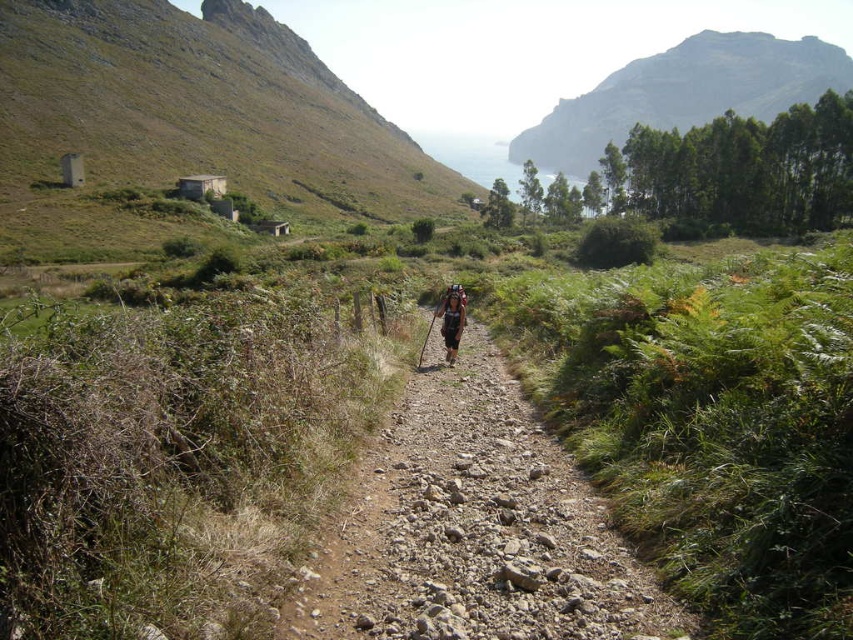
Who is higher up, green rocky mountain at upper center or dark brown leather backpack at center?

green rocky mountain at upper center is higher up.

Does green rocky mountain at upper center appear on the right side of dark brown leather backpack at center?

Yes, green rocky mountain at upper center is to the right of dark brown leather backpack at center.

Describe the element at coordinates (683, 93) in the screenshot. The image size is (853, 640). I see `green rocky mountain at upper center` at that location.

Image resolution: width=853 pixels, height=640 pixels. I want to click on green rocky mountain at upper center, so click(683, 93).

Measure the distance between dusty gravel trail at center and camera.

dusty gravel trail at center is 5.41 meters away from camera.

The height and width of the screenshot is (640, 853). Describe the element at coordinates (473, 529) in the screenshot. I see `dusty gravel trail at center` at that location.

What are the coordinates of `dusty gravel trail at center` in the screenshot? It's located at (473, 529).

Between dusty gravel trail at center and green rocky mountain at upper center, which one has more height?

Standing taller between the two is green rocky mountain at upper center.

Can you confirm if dusty gravel trail at center is taller than green rocky mountain at upper center?

No, dusty gravel trail at center is not taller than green rocky mountain at upper center.

Is point (509, 445) farther from camera compared to point (595, 106)?

No, (509, 445) is closer to viewer.

I want to click on dusty gravel trail at center, so click(473, 529).